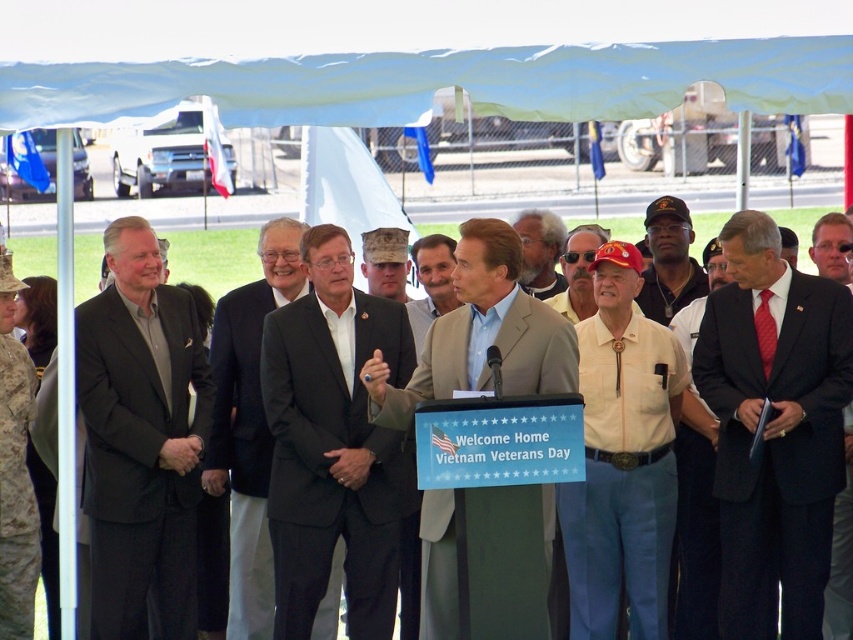
Question: Estimate the real-world distances between objects in this image. Which object is closer to the camouflage fabric hat at center?

Choices:
 (A) black suit at center
 (B) gray hair at center
 (C) dark gray suit at center
 (D) dark gray suit at left

Answer: (B)

Question: Which point is closer to the camera?

Choices:
 (A) green fabric canopy at upper center
 (B) gray hair at center
 (C) dark gray suit at left

Answer: (A)

Question: Does dark gray suit at left have a lesser width compared to matte black cap at center?

Choices:
 (A) yes
 (B) no

Answer: (B)

Question: Does dark gray suit at left have a greater width compared to gray hair at center?

Choices:
 (A) yes
 (B) no

Answer: (A)

Question: Can you confirm if dark blue suit at center is positioned to the left of camouflage fabric hat at center?

Choices:
 (A) no
 (B) yes

Answer: (A)

Question: Which of the following is the closest to the observer?

Choices:
 (A) gray hair at center
 (B) camouflage fabric hat at center
 (C) matte black cap at center

Answer: (C)